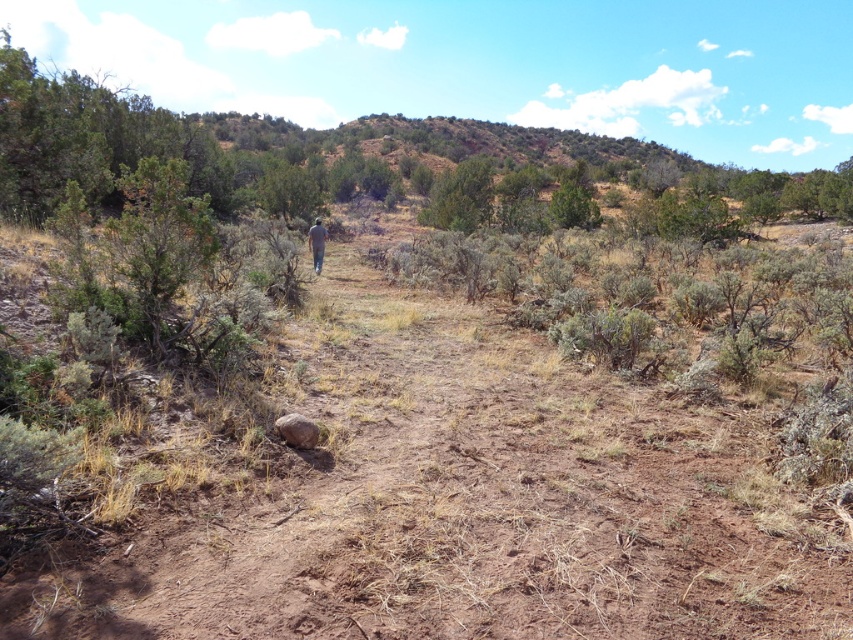
Question: Does brown dirt track at center have a smaller size compared to gray fabric pants at center?

Choices:
 (A) no
 (B) yes

Answer: (A)

Question: Which of the following is the farthest from the observer?

Choices:
 (A) (554, 374)
 (B) (320, 246)

Answer: (B)

Question: Does brown dirt track at center come in front of gray fabric pants at center?

Choices:
 (A) no
 (B) yes

Answer: (B)

Question: Which object appears closest to the camera in this image?

Choices:
 (A) brown dirt track at center
 (B) gray fabric pants at center

Answer: (A)

Question: Can you confirm if brown dirt track at center is positioned to the right of gray fabric pants at center?

Choices:
 (A) no
 (B) yes

Answer: (B)